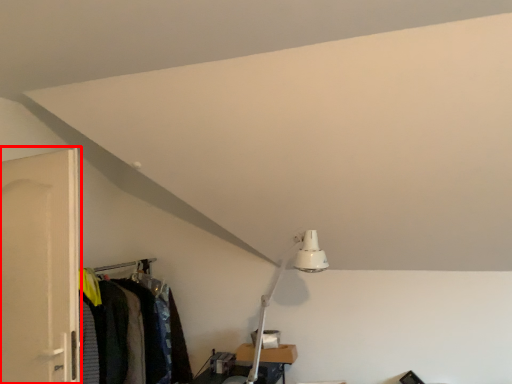
Question: From the image's perspective, what is the correct spatial relationship of door (annotated by the red box) in relation to closet?

Choices:
 (A) below
 (B) above

Answer: (B)